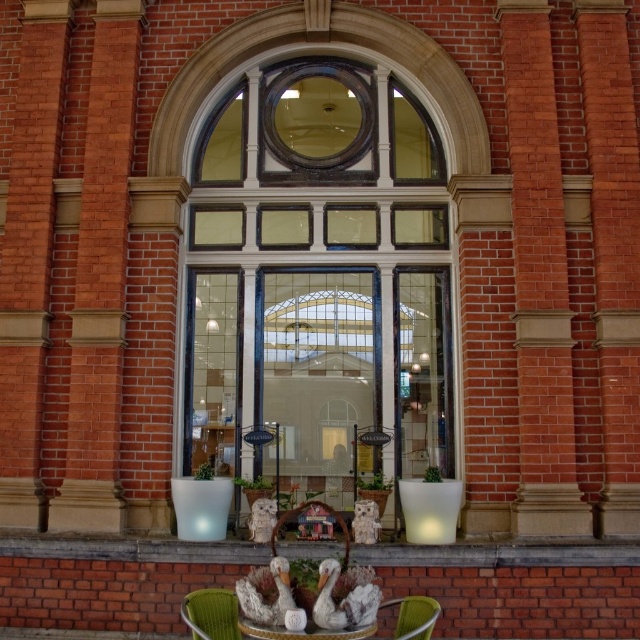
You are a delivery person trying to bring a large package through the clear glass door at center. The package is 1.2 meters wide. Can you fit the package through the door if the green fabric chair at lower center is blocking the path?

The clear glass door at center might be wider than green fabric chair at lower center. Since the package is 1.2 meters wide, and the door could be wider than the chair, it is possible that the package can fit through the door if the chair is moved out of the way. However, without exact measurements, there is some uncertainty.

Looking at this image, you are standing outside the building and want to enter through the clear glass door at center. To do so, you need to move the metallic green chair at lower center out of the way. Is the chair currently blocking the door?

The clear glass door at center is positioned over metallic green chair at lower center, meaning the chair is directly underneath the door. Since the door is above the chair, the chair is not blocking the entrance. You can enter through the door without moving the chair.